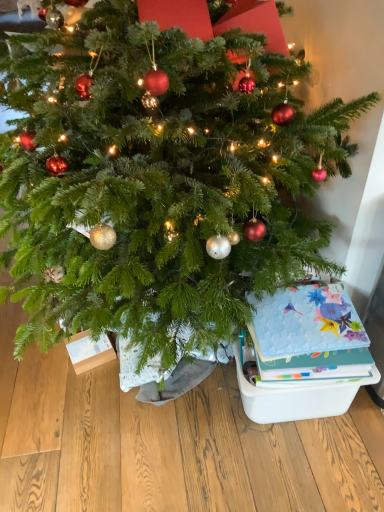
Image resolution: width=384 pixels, height=512 pixels. In order to click on free space to the left of matte plastic storage box at lower right in this screenshot , I will do `click(195, 424)`.